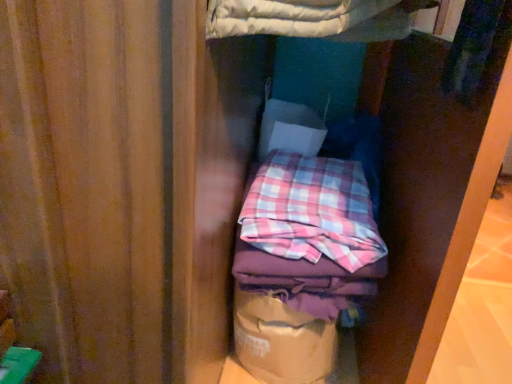
Describe the element at coordinates (282, 341) in the screenshot. I see `brown paper bag at center` at that location.

The height and width of the screenshot is (384, 512). I want to click on brown paper bag at center, so click(x=282, y=341).

The width and height of the screenshot is (512, 384). Describe the element at coordinates (312, 211) in the screenshot. I see `pink plaid fabric at center` at that location.

Measure the distance between pink plaid fabric at center and camera.

pink plaid fabric at center and camera are 79.53 centimeters apart from each other.

Identify the location of pink plaid fabric at center. Image resolution: width=512 pixels, height=384 pixels. (312, 211).

Find the location of a particular element. The image size is (512, 384). brown paper bag at center is located at coordinates (282, 341).

Between brown paper bag at center and pink plaid fabric at center, which one appears on the right side from the viewer's perspective?

From the viewer's perspective, pink plaid fabric at center appears more on the right side.

Who is more distant, brown paper bag at center or pink plaid fabric at center?

Positioned behind is brown paper bag at center.

Does point (278, 313) lie behind point (356, 175)?

No, (278, 313) is in front of (356, 175).

From the image's perspective, is brown paper bag at center under pink plaid fabric at center?

Correct, brown paper bag at center appears lower than pink plaid fabric at center in the image.

From a real-world perspective, who is located higher, brown paper bag at center or pink plaid fabric at center?

pink plaid fabric at center is physically above.

Looking at their sizes, would you say brown paper bag at center is wider or thinner than pink plaid fabric at center?

brown paper bag at center is thinner than pink plaid fabric at center.

Considering the relative sizes of brown paper bag at center and pink plaid fabric at center in the image provided, is brown paper bag at center shorter than pink plaid fabric at center?

Incorrect, the height of brown paper bag at center does not fall short of that of pink plaid fabric at center.

Can you confirm if brown paper bag at center is bigger than pink plaid fabric at center?

Incorrect, brown paper bag at center is not larger than pink plaid fabric at center.

Is brown paper bag at center positioned beyond the bounds of pink plaid fabric at center?

That's correct, brown paper bag at center is outside of pink plaid fabric at center.

Would you say brown paper bag at center is a long distance from pink plaid fabric at center?

That's not correct — brown paper bag at center is a little close to pink plaid fabric at center.

Could you tell me if brown paper bag at center is turned towards pink plaid fabric at center?

No, brown paper bag at center is not aimed at pink plaid fabric at center.

Can you tell me how much brown paper bag at center and pink plaid fabric at center differ in facing direction?

0.23 degrees.

The height and width of the screenshot is (384, 512). I want to click on paper bag below the pink plaid fabric at center (from a real-world perspective), so click(282, 341).

Based on their positions, is pink plaid fabric at center located to the left or right of brown paper bag at center?

In the image, pink plaid fabric at center appears on the right side of brown paper bag at center.

Between pink plaid fabric at center and brown paper bag at center, which one is positioned behind?

brown paper bag at center.

Is point (324, 201) positioned before point (255, 301)?

No, it is behind (255, 301).

From the image's perspective, which is below, pink plaid fabric at center or brown paper bag at center?

brown paper bag at center.

From a real-world perspective, relative to brown paper bag at center, is pink plaid fabric at center vertically above or below?

pink plaid fabric at center is above brown paper bag at center.

Is pink plaid fabric at center wider than brown paper bag at center?

Yes, pink plaid fabric at center is wider than brown paper bag at center.

Is pink plaid fabric at center shorter than brown paper bag at center?

Yes, pink plaid fabric at center is shorter than brown paper bag at center.

Which of these two, pink plaid fabric at center or brown paper bag at center, is bigger?

pink plaid fabric at center is bigger.

Based on the photo, would you say pink plaid fabric at center is inside or outside brown paper bag at center?

pink plaid fabric at center lies outside brown paper bag at center.

Is pink plaid fabric at center directly adjacent to brown paper bag at center?

No, pink plaid fabric at center is not with brown paper bag at center.

Is pink plaid fabric at center turned away from brown paper bag at center?

No.

How many degrees apart are the facing directions of pink plaid fabric at center and brown paper bag at center?

There is a 0.23-degree angle between the facing directions of pink plaid fabric at center and brown paper bag at center.

Where is `paper bag on the left of pink plaid fabric at center`? This screenshot has height=384, width=512. paper bag on the left of pink plaid fabric at center is located at coordinates (282, 341).

Find the location of a particular element. The image size is (512, 384). flannel on the right of brown paper bag at center is located at coordinates (312, 211).

Where is `paper bag on the left of pink plaid fabric at center`? This screenshot has width=512, height=384. paper bag on the left of pink plaid fabric at center is located at coordinates (282, 341).